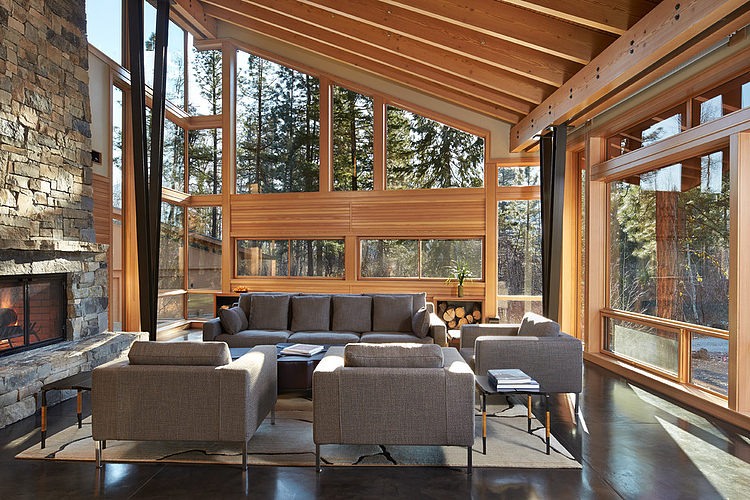
You are a GUI agent. You are given a task and a screenshot of the screen. Output one action in this format:
    pyautogui.click(x=<x>, y=<y>)
    Task: Click on the floor
    This screenshot has width=750, height=500.
    Given the screenshot: What is the action you would take?
    pyautogui.click(x=609, y=444)